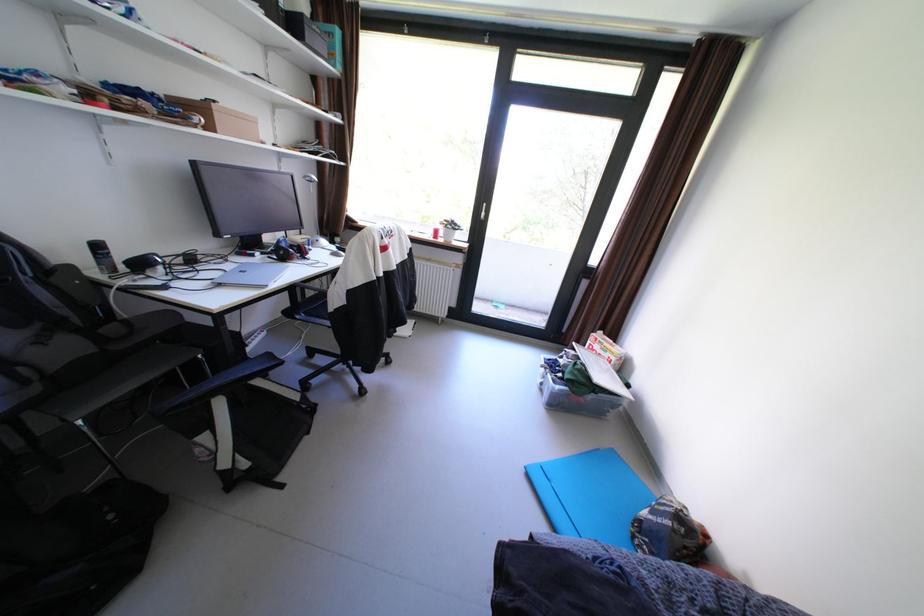
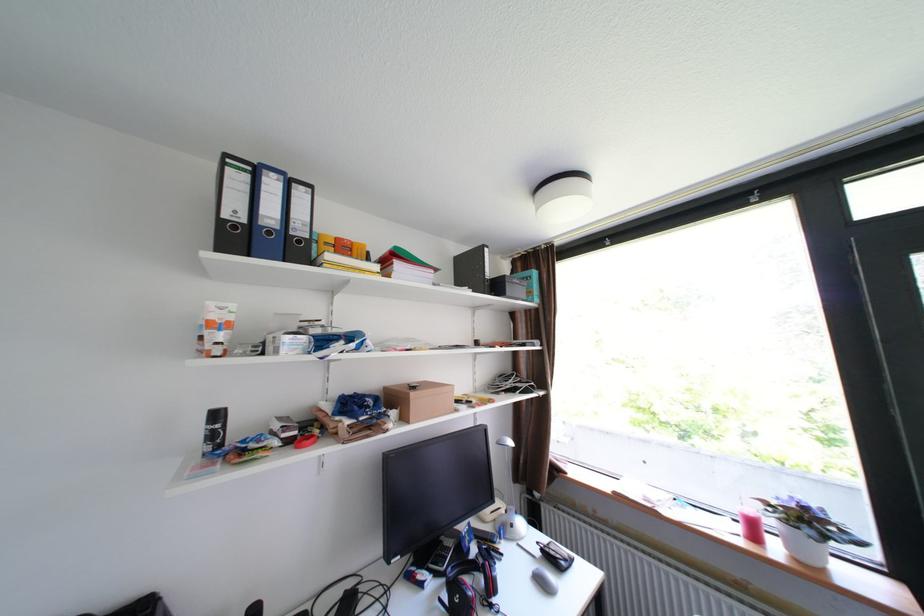
The point at (274,254) is marked in the first image. Where is the corresponding point in the second image?

(446, 576)